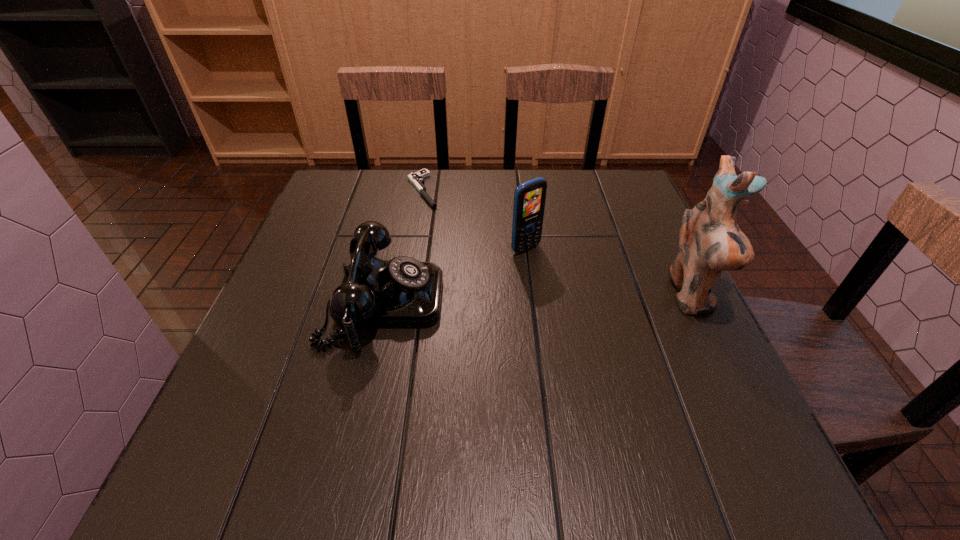
The height and width of the screenshot is (540, 960). Identify the location of vacant space that is in between the tallest object and the farthest object. (557, 243).

This screenshot has height=540, width=960. What are the coordinates of `free space between the third object from left to right and the rightmost object` in the screenshot? It's located at (609, 273).

Find the location of `free space between the rightmost object and the pistol`. free space between the rightmost object and the pistol is located at coordinates (557, 243).

Identify the location of blank region between the second tallest object and the figurine. This screenshot has width=960, height=540. (609, 273).

The width and height of the screenshot is (960, 540). In order to click on object that ranks as the third closest to the shortest object in this screenshot , I will do `click(710, 241)`.

The height and width of the screenshot is (540, 960). I want to click on object that is the second closest one to the pistol, so click(x=529, y=198).

The width and height of the screenshot is (960, 540). Identify the location of blank space that satisfies the following two spatial constraints: 1. on the front side of the third shortest object; 2. on the front-facing side of the figurine. (531, 296).

Image resolution: width=960 pixels, height=540 pixels. I want to click on vacant point that satisfies the following two spatial constraints: 1. on the front side of the rightmost object; 2. on the front-facing side of the second object from right to left, so click(x=531, y=296).

Find the location of a particular element. free location that satisfies the following two spatial constraints: 1. on the front side of the shortest object; 2. on the front-facing side of the figurine is located at coordinates (403, 296).

Locate an element on the screen. vacant space that satisfies the following two spatial constraints: 1. on the front side of the tallest object; 2. on the front-facing side of the second tallest object is located at coordinates (531, 296).